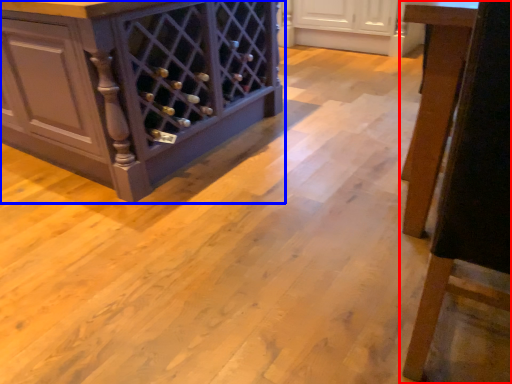
Question: Which of the following is the closest to the observer, furniture (highlighted by a red box) or cabinetry (highlighted by a blue box)?

Choices:
 (A) furniture
 (B) cabinetry

Answer: (A)